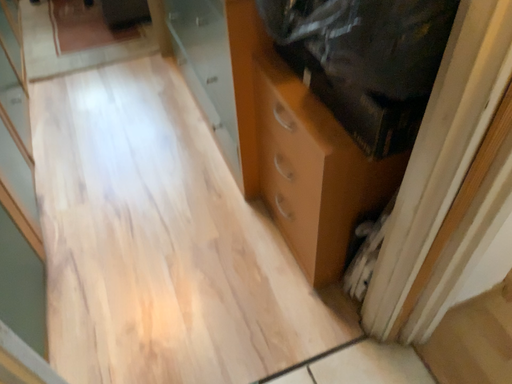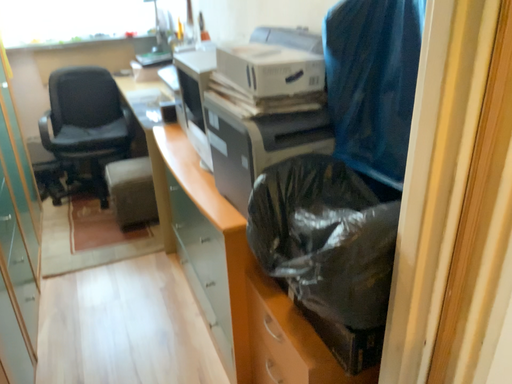
Question: How did the camera likely rotate when shooting the video?

Choices:
 (A) rotated downward
 (B) rotated upward

Answer: (B)